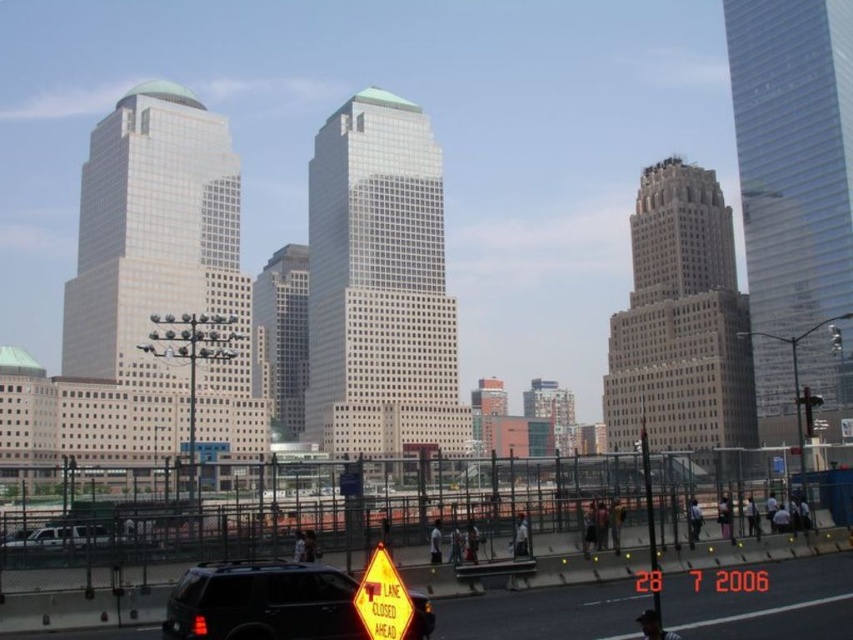
You are a delivery driver who needs to park your vehicle. You see a black matte suv at lower left and a silver metallic suv at lower left. Which vehicle should you avoid parking next to if you want to leave more space for other cars?

You should avoid parking next to the black matte suv at lower left because it is larger in size than the silver metallic suv at lower left, leaving less space for other cars.

You are a pedestrian standing on the sidewalk behind the chain link fence. You see the black matte suv at lower left and the yellow reflective plastic traffic sign at lower center. Which object is closer to you?

The yellow reflective plastic traffic sign at lower center is closer to you because the black matte suv at lower left is positioned under it, meaning the sign is in front of the SUV and therefore nearer to your position on the sidewalk.

You are a delivery driver approaching the yellow reflective plastic traffic sign at lower center. You need to take a photo of the sign with your camera. Can you do it from your current position without moving closer?

The yellow reflective plastic traffic sign at lower center and camera are 34.33 meters apart from each other. Since the distance is too far for a clear photo, you need to move closer to take a clear picture.